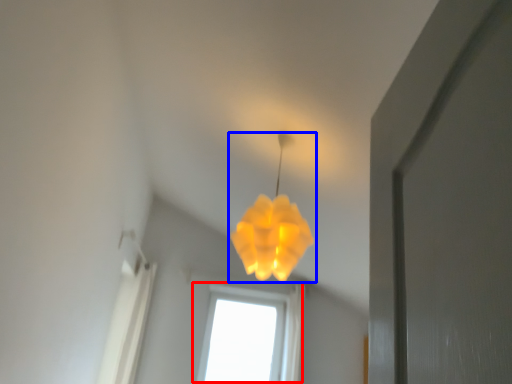
Question: Which object is further to the camera taking this photo, window (highlighted by a red box) or lamp (highlighted by a blue box)?

Choices:
 (A) window
 (B) lamp

Answer: (A)